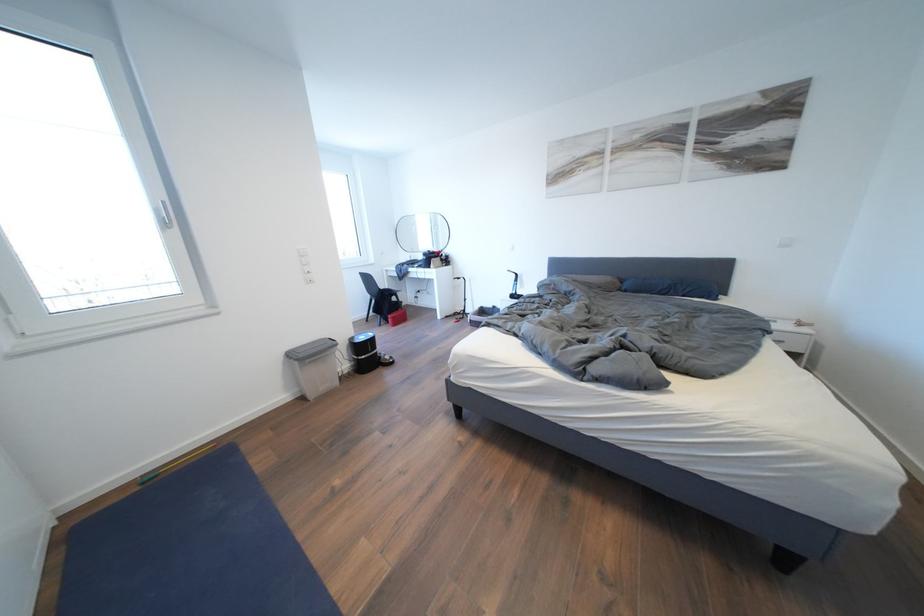
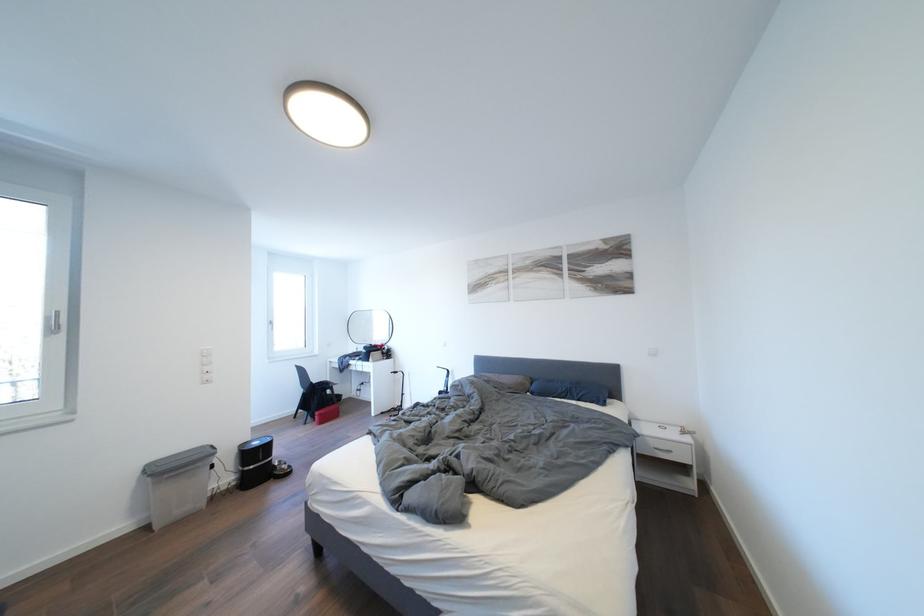
Where in the second image is the point corresponding to pixel 634 291 from the first image?

(541, 392)